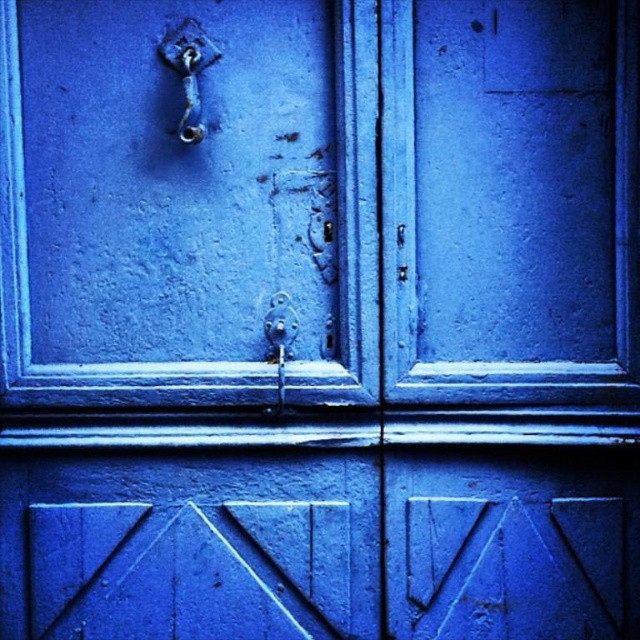
Between matte blue door handle at upper left and polished brass hook at upper left, which one has less height?

With less height is polished brass hook at upper left.

Does matte blue door handle at upper left have a lesser height compared to polished brass hook at upper left?

In fact, matte blue door handle at upper left may be taller than polished brass hook at upper left.

Is point (376, 353) positioned after point (198, 24)?

Yes, point (376, 353) is behind point (198, 24).

Find the location of `matte blue door handle at upper left`. matte blue door handle at upper left is located at coordinates (188, 202).